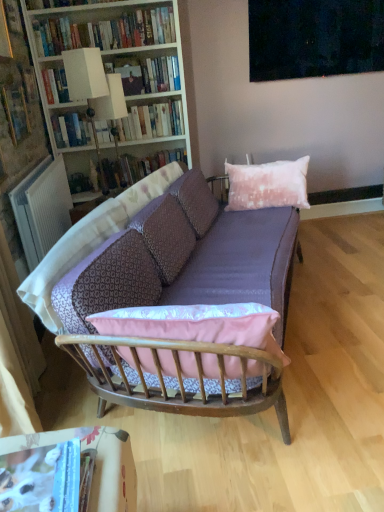
Locate an element on the screen. free spot above hardcover book at upper center, arranged as the fifth book when ordered from the bottom (from a real-world perspective) is located at coordinates (156, 55).